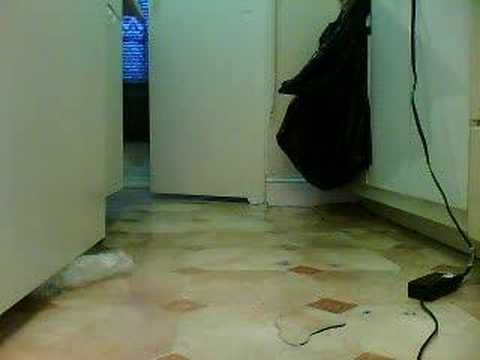
Identify the location of the back white door. (213, 85).